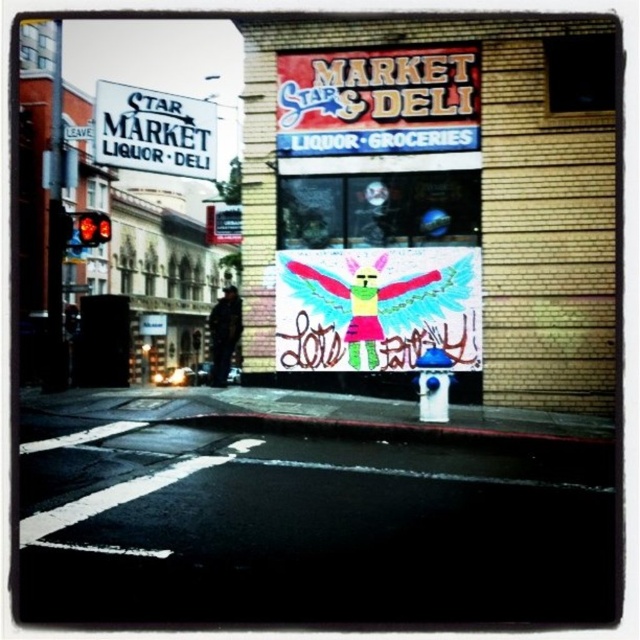
Question: Which point is closer to the camera?

Choices:
 (A) (124, 122)
 (B) (216, 352)

Answer: (A)

Question: Does white paper sign at center have a greater width compared to dark blue jacket at center?

Choices:
 (A) yes
 (B) no

Answer: (B)

Question: Which point appears closest to the camera in this image?

Choices:
 (A) (108, 140)
 (B) (337, 141)

Answer: (B)

Question: Does white paper sign at center appear over white plastic sign at upper left?

Choices:
 (A) no
 (B) yes

Answer: (A)

Question: Is white plastic sign at upper left further to the viewer compared to dark blue jacket at center?

Choices:
 (A) yes
 (B) no

Answer: (B)

Question: Which point appears closest to the camera in this image?

Choices:
 (A) (189, 157)
 (B) (582, 385)
 (C) (212, 312)

Answer: (B)